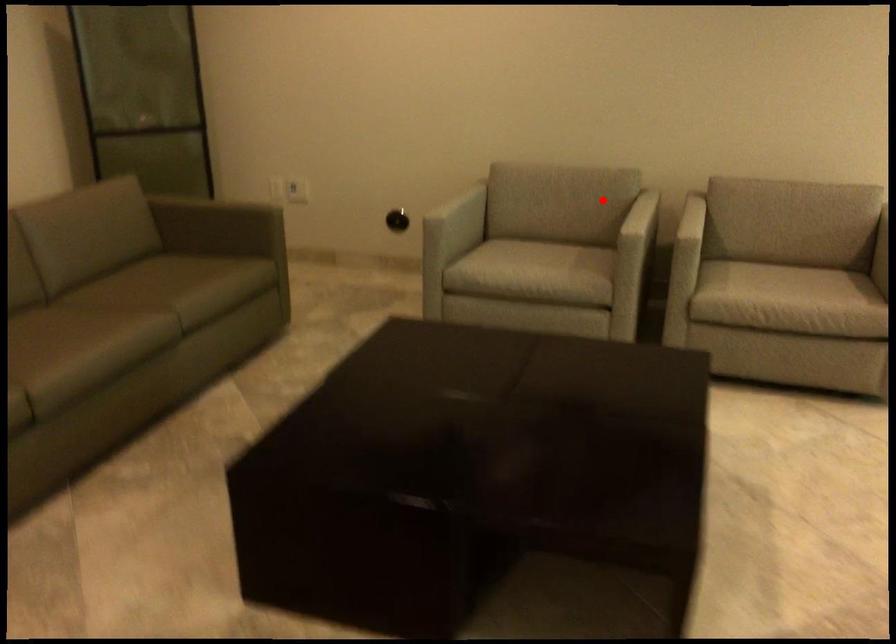
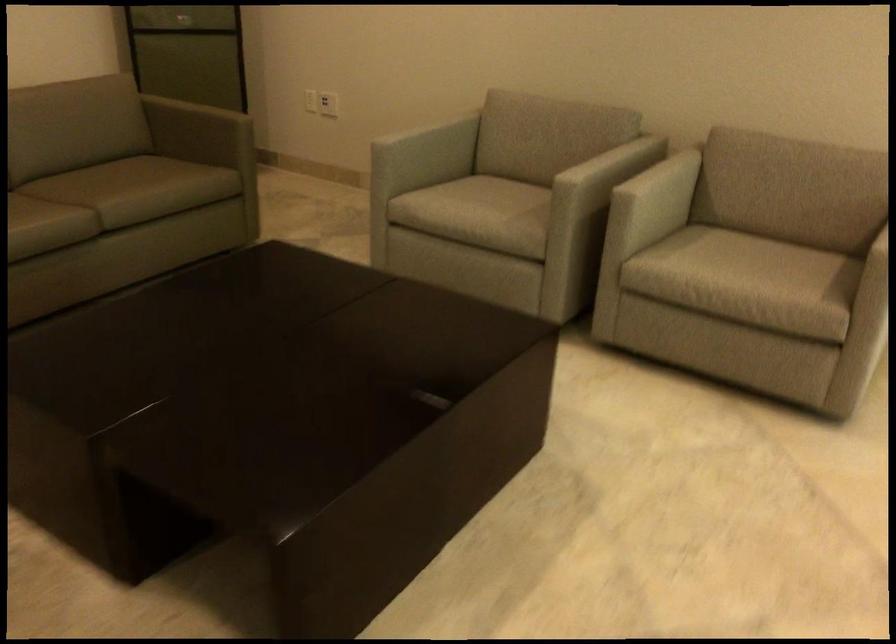
Question: A red point is marked in image1. In image2, is the corresponding 3D point closer to the camera or farther? Reply with the corresponding letter.

Choices:
 (A) The corresponding 3D point is closer.
 (B) The corresponding 3D point is farther.

Answer: (A)